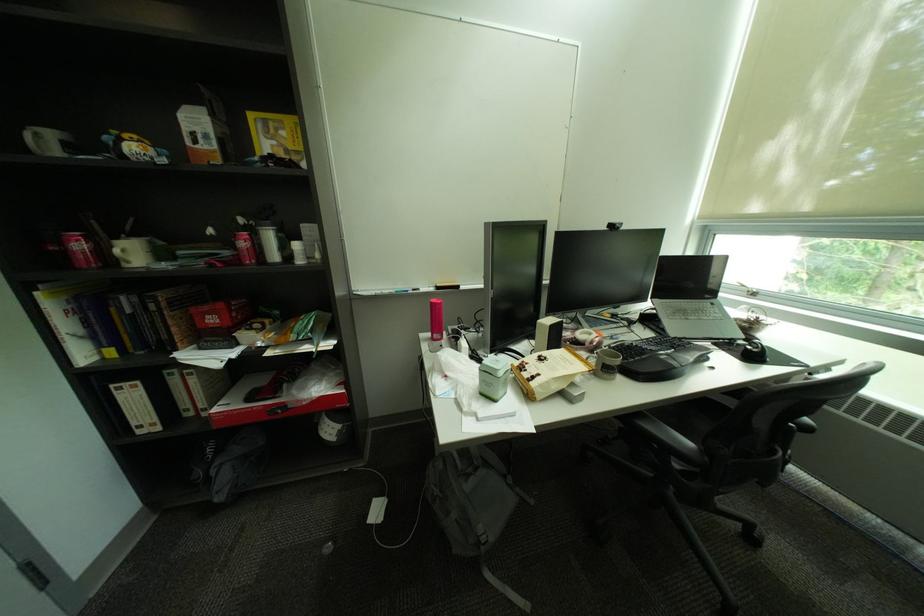
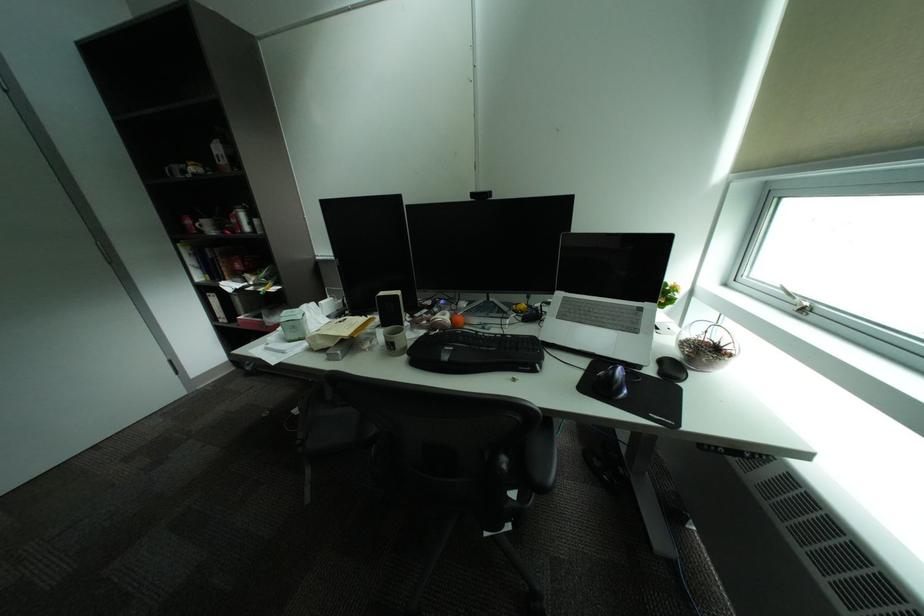
Locate, in the second image, the point that corresponds to (x=91, y=246) in the first image.

(199, 223)